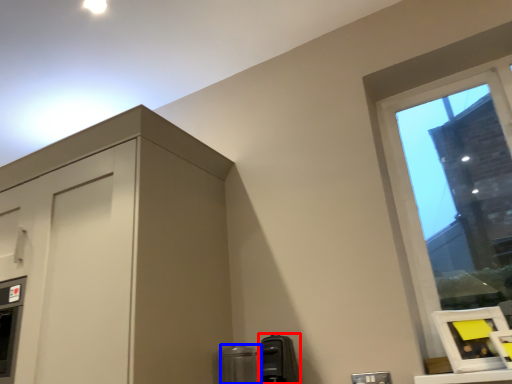
Question: Among these objects, which one is farthest to the camera, appliance (highlighted by a red box) or appliance (highlighted by a blue box)?

Choices:
 (A) appliance
 (B) appliance

Answer: (B)